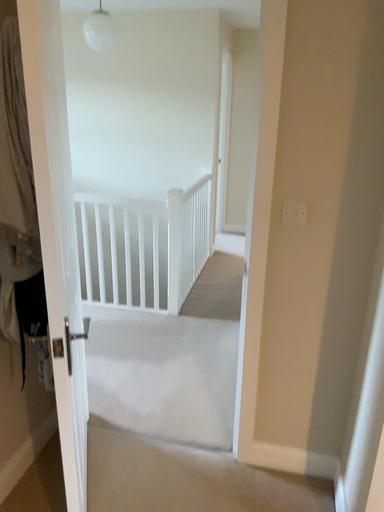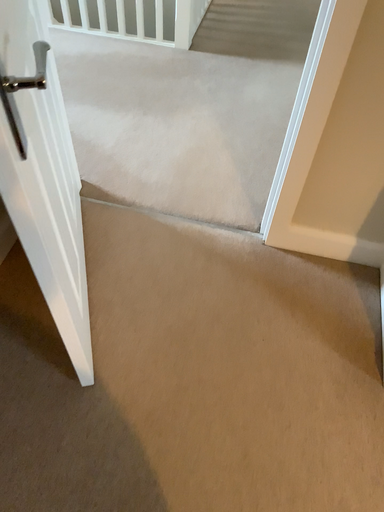
Question: How did the camera likely rotate when shooting the video?

Choices:
 (A) rotated upward
 (B) rotated downward

Answer: (B)